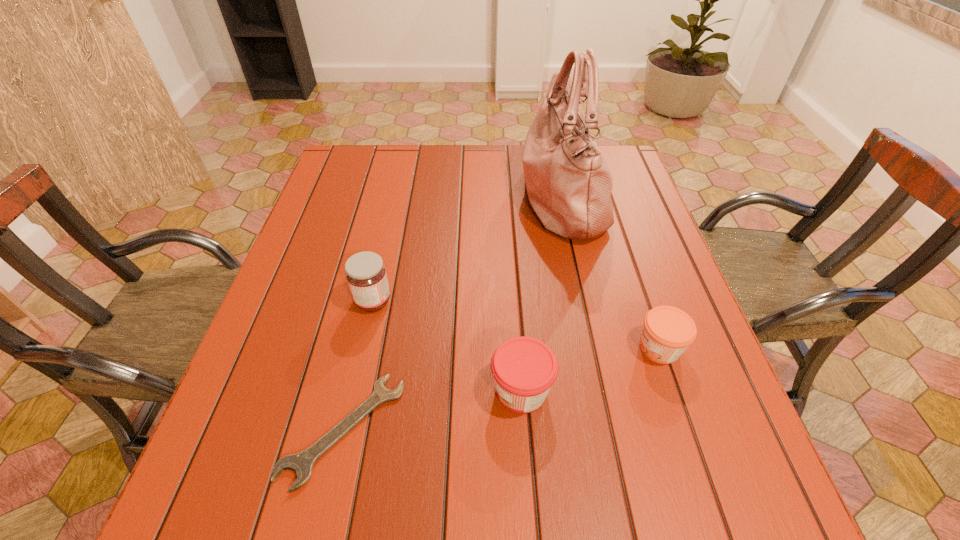
Image resolution: width=960 pixels, height=540 pixels. Identify the location of the farthest object. (569, 184).

At what (x,y) coordinates should I click in order to perform the action: click on handbag. Please return your answer as a coordinate pair (x, y). The image size is (960, 540). Looking at the image, I should click on (569, 184).

What are the coordinates of `the fourth shortest object` in the screenshot? It's located at (366, 275).

I want to click on the farthest jam, so click(x=366, y=275).

At what (x,y) coordinates should I click in order to perform the action: click on the second shortest jam. Please return your answer as a coordinate pair (x, y). This screenshot has height=540, width=960. Looking at the image, I should click on (524, 369).

Locate an element on the screen. This screenshot has height=540, width=960. the third tallest object is located at coordinates [524, 369].

The height and width of the screenshot is (540, 960). I want to click on the second shortest object, so click(x=667, y=331).

Find the location of `the shortest jam`. the shortest jam is located at coordinates (667, 331).

Where is `the shortest object`? The height and width of the screenshot is (540, 960). the shortest object is located at coordinates (301, 463).

Where is `vacant space situated at the front of the handbag with handles`? vacant space situated at the front of the handbag with handles is located at coordinates (442, 197).